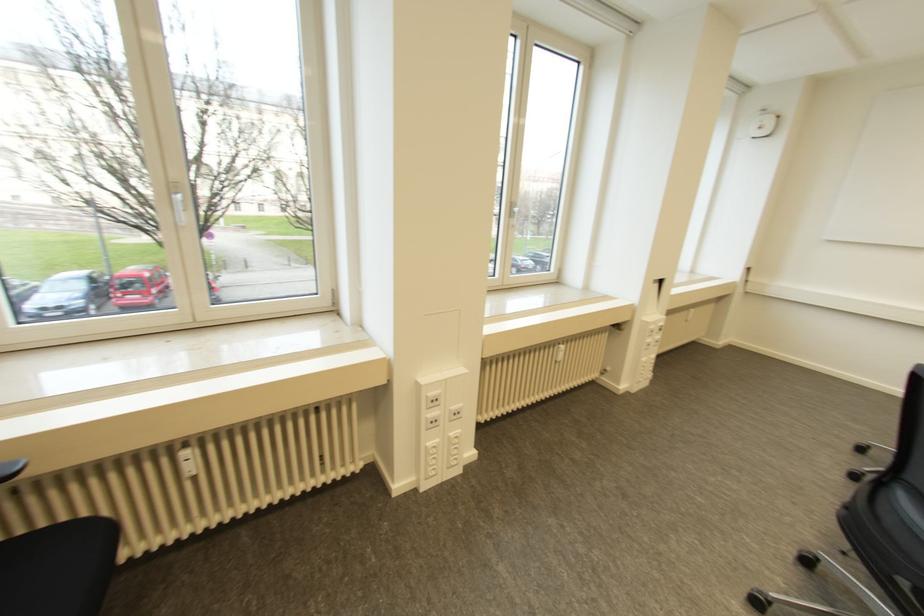
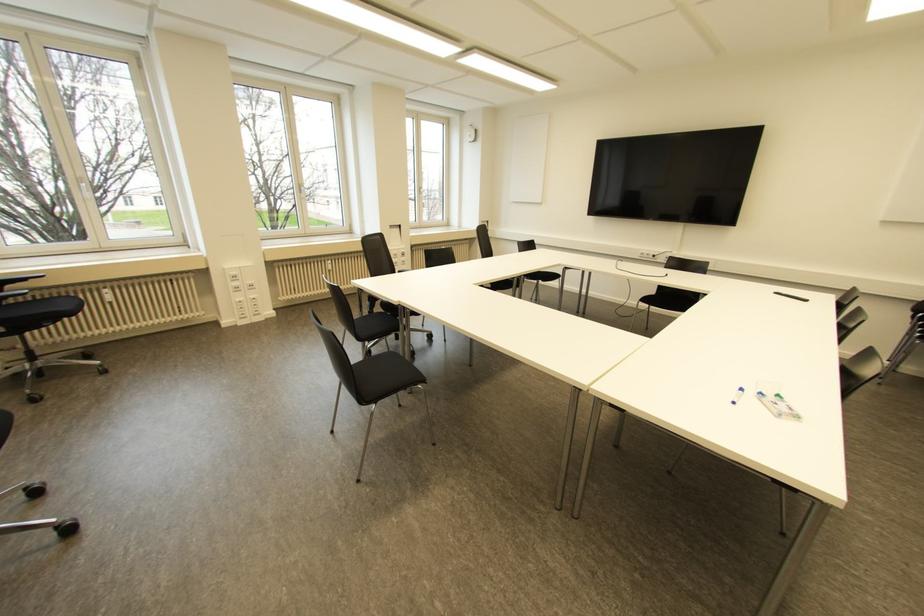
Locate, in the second image, the point that corresponds to (558,355) in the first image.

(330, 267)